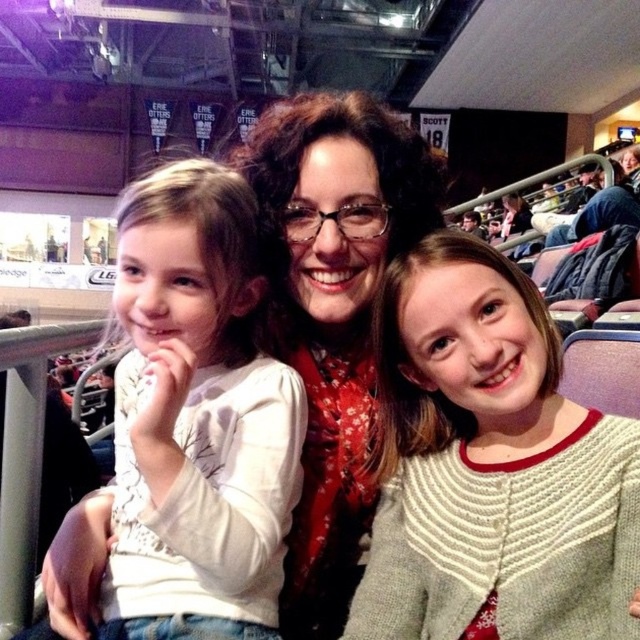
Question: Does white knitted cardigan at center appear under white matte shirt at center?

Choices:
 (A) yes
 (B) no

Answer: (A)

Question: Is white knitted cardigan at center positioned before white matte shirt at center?

Choices:
 (A) no
 (B) yes

Answer: (B)

Question: Can you confirm if white knitted cardigan at center is positioned below white matte shirt at center?

Choices:
 (A) yes
 (B) no

Answer: (A)

Question: Which of the following is the farthest from the observer?

Choices:
 (A) (422, 512)
 (B) (196, 486)

Answer: (A)

Question: Which point is farther to the camera?

Choices:
 (A) white matte shirt at center
 (B) white knitted cardigan at center

Answer: (A)